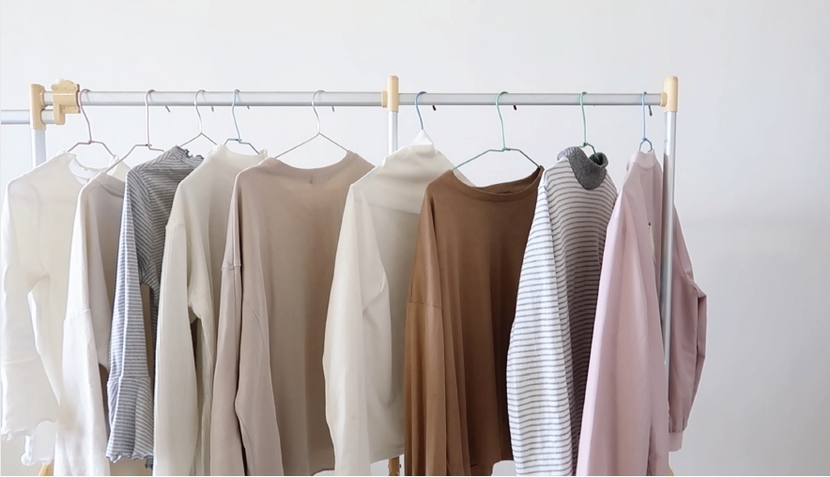
Where is `hanger`? hanger is located at coordinates (506, 148), (583, 144), (643, 137), (421, 122), (318, 132), (236, 140), (201, 132), (148, 144), (88, 139).